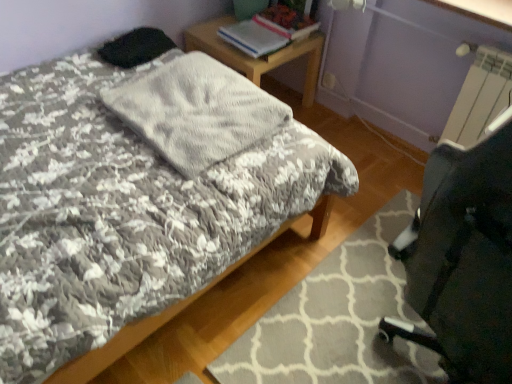
Measure the distance between point [170,123] and camera.

Point [170,123] and camera are 1.55 meters apart from each other.

This screenshot has width=512, height=384. What do you see at coordinates (196, 111) in the screenshot?
I see `fluffy gray blanket at center` at bounding box center [196, 111].

Measure the distance between fluffy fabric bed at center and camera.

fluffy fabric bed at center is 38.35 inches away from camera.

Measure the distance between point (270, 149) and camera.

Point (270, 149) and camera are 1.53 meters apart.

What do you see at coordinates (338, 319) in the screenshot?
I see `gray textured rug at lower right` at bounding box center [338, 319].

Identify the location of fluffy gray blanket at center. This screenshot has height=384, width=512. (196, 111).

Could you tell me if fluffy gray blanket at center is facing hardcover book at upper center, which appears as the first book when viewed from the right?

Yes, fluffy gray blanket at center faces towards hardcover book at upper center, which appears as the first book when viewed from the right.

Find the location of a particular element. This screenshot has width=512, height=384. blanket that is in front of the hardcover book at upper center, the second book in the left-to-right sequence is located at coordinates (196, 111).

Is fluffy gray blanket at center thinner than hardcover book at upper center, the second book in the left-to-right sequence?

Incorrect, the width of fluffy gray blanket at center is not less than that of hardcover book at upper center, the second book in the left-to-right sequence.

From the picture: Does fluffy gray blanket at center have a greater height compared to hardcover book at upper center, which appears as the first book when viewed from the right?

Yes.

Where is `book that is on the left side of wooden desk at upper center`? The image size is (512, 384). book that is on the left side of wooden desk at upper center is located at coordinates (269, 31).

Looking at the image, does hardcover book at upper center, the second book viewed from the right, seem bigger or smaller compared to wooden desk at upper center?

In the image, hardcover book at upper center, the second book viewed from the right, appears to be smaller than wooden desk at upper center.

Considering the relative positions of hardcover book at upper center, the second book viewed from the right, and wooden desk at upper center in the image provided, is hardcover book at upper center, the second book viewed from the right, to the left of wooden desk at upper center from the viewer's perspective?

Indeed, hardcover book at upper center, the second book viewed from the right, is positioned on the left side of wooden desk at upper center.

Is hardcover book at upper center, positioned as the 1th book in left-to-right order, closer to camera compared to wooden desk at upper center?

Yes, the depth of hardcover book at upper center, positioned as the 1th book in left-to-right order, is less than that of wooden desk at upper center.

Does wooden desk at upper center contain fluffy fabric bed at center?

No, fluffy fabric bed at center is not surrounded by wooden desk at upper center.

What's the angular difference between wooden desk at upper center and fluffy fabric bed at center's facing directions?

They differ by 180 degrees in their facing directions.

Looking at this image, from their relative heights in the image, would you say wooden desk at upper center is taller or shorter than fluffy fabric bed at center?

Considering their sizes, wooden desk at upper center has less height than fluffy fabric bed at center.

Is the position of fluffy fabric bed at center less distant than that of hardcover book at upper center, the second book viewed from the right?

Yes, fluffy fabric bed at center is closer to the viewer.

Is point (309, 140) closer to camera compared to point (265, 50)?

Yes.

From a real-world perspective, is fluffy fabric bed at center under hardcover book at upper center, the second book viewed from the right?

Yes, from a real-world perspective, fluffy fabric bed at center is below hardcover book at upper center, the second book viewed from the right.

This screenshot has width=512, height=384. I want to click on bed that appears below the hardcover book at upper center, the second book viewed from the right (from the image's perspective), so click(x=122, y=213).

Which is closer to the camera, (92, 55) or (306, 283)?

Point (92, 55).

Is the surface of fluffy fabric bed at center in direct contact with gray textured rug at lower right?

There is a gap between fluffy fabric bed at center and gray textured rug at lower right.

Is fluffy fabric bed at center to the left or to the right of gray textured rug at lower right in the image?

fluffy fabric bed at center is to the left of gray textured rug at lower right.

Which of these two, fluffy fabric bed at center or gray textured rug at lower right, stands shorter?

With less height is gray textured rug at lower right.

Which object is more forward, wooden desk at upper center or fluffy gray blanket at center?

fluffy gray blanket at center.

Does wooden desk at upper center have a lesser height compared to fluffy gray blanket at center?

No, wooden desk at upper center is not shorter than fluffy gray blanket at center.

Does wooden desk at upper center appear on the left side of fluffy gray blanket at center?

Incorrect, wooden desk at upper center is not on the left side of fluffy gray blanket at center.

Considering the sizes of objects fluffy fabric bed at center and wooden desk at upper center in the image provided, who is bigger, fluffy fabric bed at center or wooden desk at upper center?

With larger size is fluffy fabric bed at center.

From a real-world perspective, between fluffy fabric bed at center and wooden desk at upper center, who is vertically higher?

fluffy fabric bed at center, from a real-world perspective.

Considering the relative sizes of fluffy fabric bed at center and wooden desk at upper center in the image provided, is fluffy fabric bed at center taller than wooden desk at upper center?

Yes, fluffy fabric bed at center is taller than wooden desk at upper center.

Is fluffy fabric bed at center wider or thinner than wooden desk at upper center?

Considering their sizes, fluffy fabric bed at center looks broader than wooden desk at upper center.

Find the location of a particular element. The width and height of the screenshot is (512, 384). blanket to the left of hardcover book at upper center, which appears as the first book when viewed from the right is located at coordinates (196, 111).

Locate an element on the screen. This screenshot has height=384, width=512. book that is the 1st object above the wooden desk at upper center (from a real-world perspective) is located at coordinates (269, 31).

From the image, which object appears to be farther from hardcover book at upper center, positioned as the 1th book in left-to-right order, hardcover book at upper center, which appears as the first book when viewed from the right, or wooden desk at upper center?

wooden desk at upper center is positioned further to the anchor hardcover book at upper center, positioned as the 1th book in left-to-right order.

From the picture: Looking at the image, which one is located further to wooden desk at upper center, fluffy gray blanket at center or gray textured rug at lower right?

gray textured rug at lower right is positioned further to the anchor wooden desk at upper center.

Considering their positions, is gray textured rug at lower right positioned further to wooden desk at upper center than hardcover book at upper center, the second book viewed from the right?

gray textured rug at lower right is positioned further to the anchor wooden desk at upper center.

From the image, which object appears to be farther from hardcover book at upper center, positioned as the 1th book in left-to-right order, gray textured rug at lower right or hardcover book at upper center, which appears as the first book when viewed from the right?

Based on the image, gray textured rug at lower right appears to be further to hardcover book at upper center, positioned as the 1th book in left-to-right order.

Considering their positions, is fluffy gray blanket at center positioned further to hardcover book at upper center, which appears as the first book when viewed from the right, than wooden desk at upper center?

fluffy gray blanket at center.

When comparing their distances from wooden desk at upper center, does fluffy gray blanket at center or hardcover book at upper center, the second book viewed from the right, seem closer?

The object closer to wooden desk at upper center is hardcover book at upper center, the second book viewed from the right.

Estimate the real-world distances between objects in this image. Which object is closer to hardcover book at upper center, which appears as the first book when viewed from the right, gray textured rug at lower right or fluffy fabric bed at center?

fluffy fabric bed at center is positioned closer to the anchor hardcover book at upper center, which appears as the first book when viewed from the right.

Based on their spatial positions, is hardcover book at upper center, the second book in the left-to-right sequence, or fluffy gray blanket at center closer to wooden desk at upper center?

Based on the image, hardcover book at upper center, the second book in the left-to-right sequence, appears to be nearer to wooden desk at upper center.

Locate an element on the screen. The image size is (512, 384). mat between fluffy fabric bed at center and hardcover book at upper center, positioned as the 1th book in left-to-right order, in the front-back direction is located at coordinates (338, 319).

Locate an element on the screen. The width and height of the screenshot is (512, 384). blanket between hardcover book at upper center, positioned as the 1th book in left-to-right order, and gray textured rug at lower right vertically is located at coordinates (196, 111).

The width and height of the screenshot is (512, 384). In order to click on blanket positioned between fluffy fabric bed at center and hardcover book at upper center, the second book in the left-to-right sequence, from near to far in this screenshot , I will do `click(196, 111)`.

At what (x,y) coordinates should I click in order to perform the action: click on mat located between fluffy fabric bed at center and wooden desk at upper center in the depth direction. Please return your answer as a coordinate pair (x, y). This screenshot has height=384, width=512. Looking at the image, I should click on (338, 319).